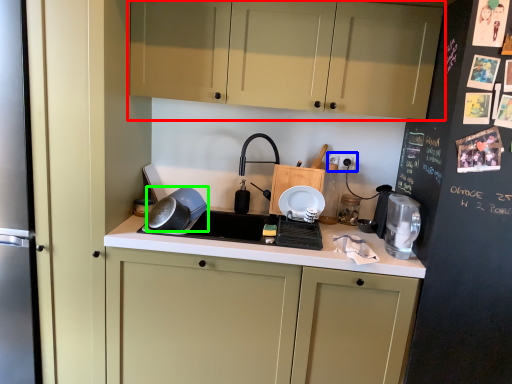
Question: Based on their relative distances, which object is farther from cabinetry (highlighted by a red box)? Choose from electric outlet (highlighted by a blue box) and kitchen appliance (highlighted by a green box).

Choices:
 (A) electric outlet
 (B) kitchen appliance

Answer: (B)